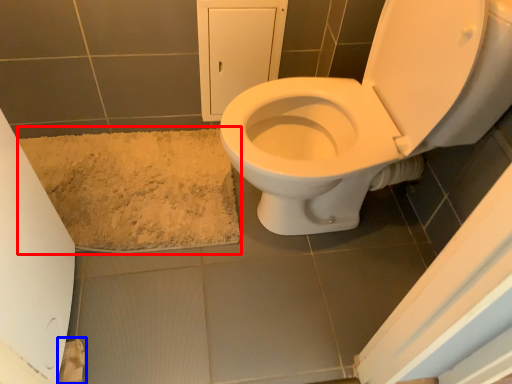
Question: Which object appears farthest to the camera in this image, bath mat (highlighted by a red box) or toilet paper (highlighted by a blue box)?

Choices:
 (A) bath mat
 (B) toilet paper

Answer: (A)